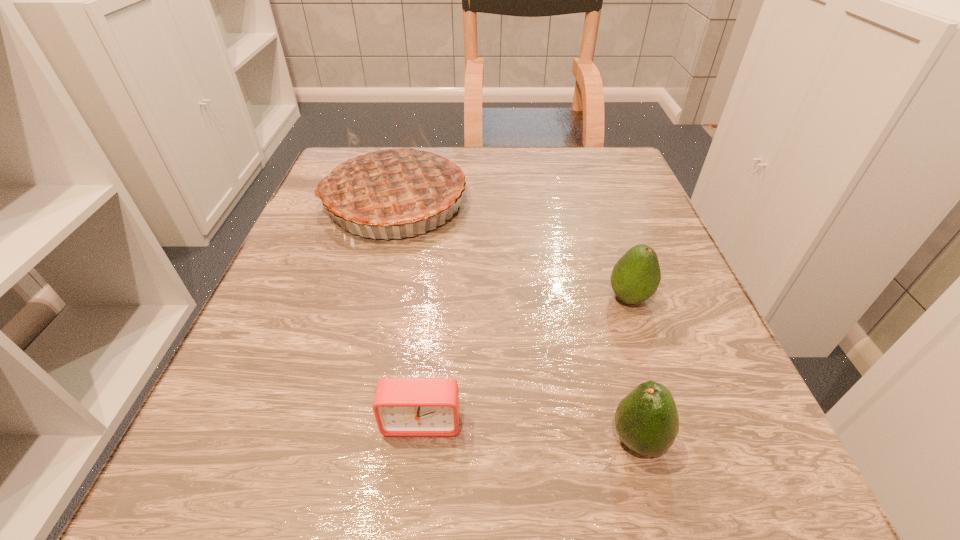
Find the location of `pie`. pie is located at coordinates (393, 185).

You are a GUI agent. You are given a task and a screenshot of the screen. Output one action in this format:
    pyautogui.click(x=<x>, y=<y>)
    Task: Click on the tallest object
    This screenshot has width=960, height=540.
    Given the screenshot: What is the action you would take?
    pyautogui.click(x=393, y=185)

At what (x,y) coordinates should I click in order to perform the action: click on the farther avocado. Please return your answer as a coordinate pair (x, y). The width and height of the screenshot is (960, 540). Looking at the image, I should click on tap(635, 277).

Find the location of a particular element. Image resolution: width=960 pixels, height=540 pixels. the nearer avocado is located at coordinates (647, 422).

This screenshot has width=960, height=540. Identify the location of the shortest object. point(402,406).

Image resolution: width=960 pixels, height=540 pixels. I want to click on free space located on the front of the pie, so click(378, 267).

I want to click on free space located 0.360m on the back of the third nearest object, so click(587, 174).

You are a GUI agent. You are given a task and a screenshot of the screen. Output one action in this format:
    pyautogui.click(x=<x>, y=<y>)
    Task: Click on the free point located 0.100m on the right of the nearer avocado
    
    Given the screenshot: What is the action you would take?
    pyautogui.click(x=748, y=440)

At what (x,y) coordinates should I click in order to perform the action: click on free space located on the front-facing side of the alarm clock. Please return your answer as a coordinate pair (x, y). This screenshot has height=540, width=960. Looking at the image, I should click on (415, 489).

I want to click on object situated at the far edge, so click(393, 185).